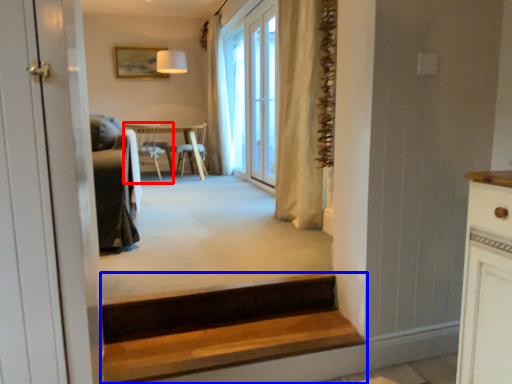
Question: Which point is further to the camera, chair (highlighted by a red box) or stairs (highlighted by a blue box)?

Choices:
 (A) chair
 (B) stairs

Answer: (A)